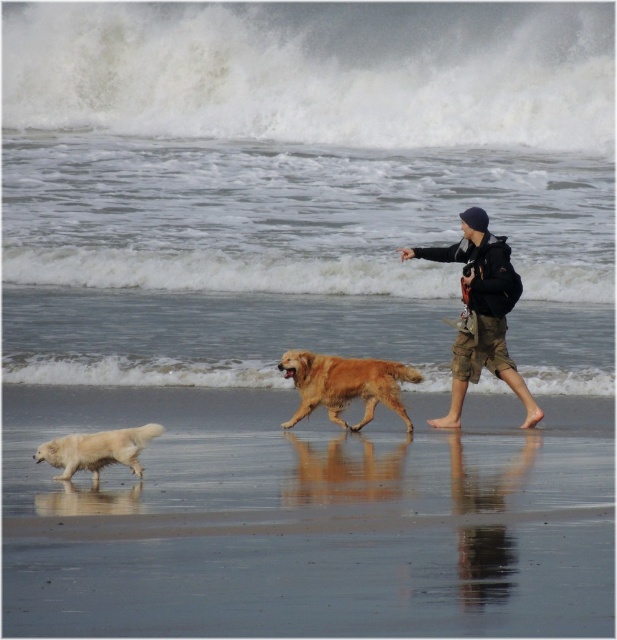
Who is positioned more to the left, white fur dog at lower left or golden fur dog at center?

From the viewer's perspective, white fur dog at lower left appears more on the left side.

Is white fur dog at lower left positioned in front of golden fur dog at center?

That is True.

What do you see at coordinates (308, 520) in the screenshot? I see `white fur dog at lower left` at bounding box center [308, 520].

Where is `white fur dog at lower left`? Image resolution: width=617 pixels, height=640 pixels. white fur dog at lower left is located at coordinates (308, 520).

The image size is (617, 640). I want to click on white fur dog at lower left, so click(x=308, y=520).

Which is behind, point (238, 589) or point (510, 273)?

Point (510, 273)

Which is in front, point (283, 396) or point (474, 301)?

Positioned in front is point (474, 301).

This screenshot has height=640, width=617. What are the coordinates of `white fur dog at lower left` in the screenshot? It's located at (308, 520).

Does dark blue knit cap at upper right appear on the left side of white fluffy dog at lower left?

In fact, dark blue knit cap at upper right is to the right of white fluffy dog at lower left.

What do you see at coordinates (481, 314) in the screenshot?
I see `dark blue knit cap at upper right` at bounding box center [481, 314].

Find the location of `dark blue knit cap at upper right`. dark blue knit cap at upper right is located at coordinates (481, 314).